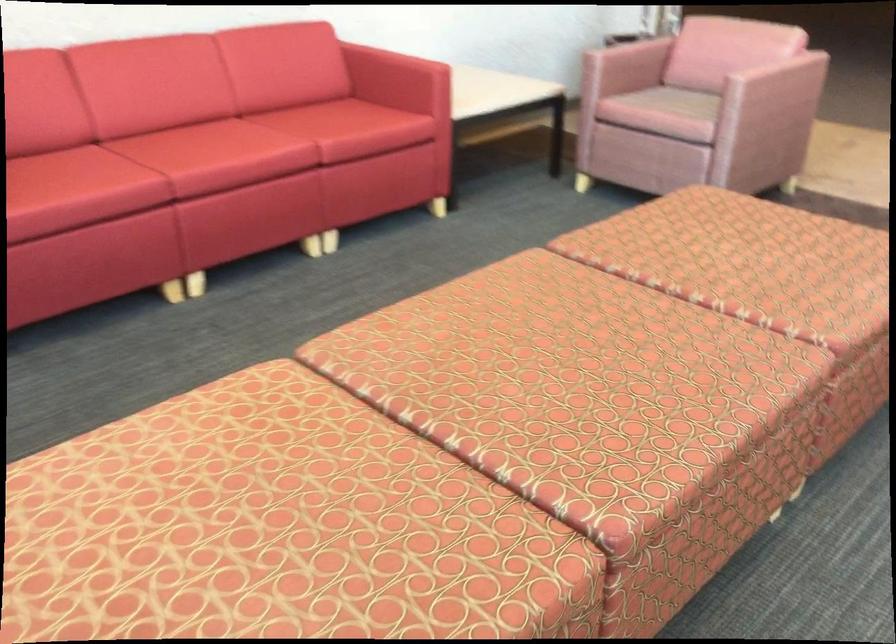
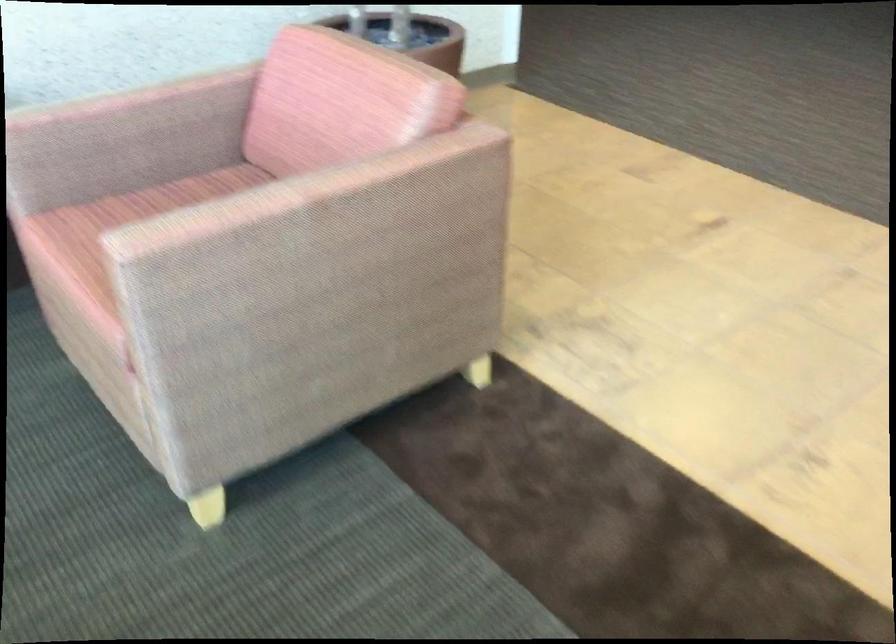
The images are taken continuously from a first-person perspective. In which direction are you moving?

The cameraman walked toward right, forward.